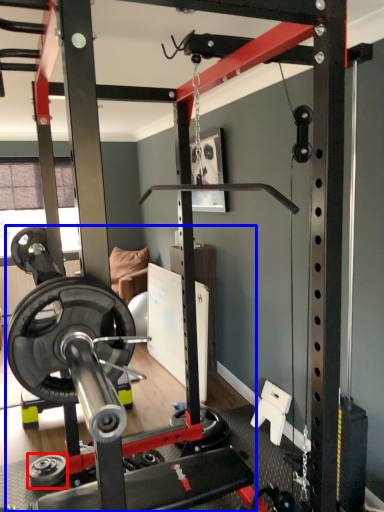
Question: Among these objects, which one is nearest to the camera, wheel (highlighted by a red box) or barbell (highlighted by a blue box)?

Choices:
 (A) wheel
 (B) barbell

Answer: (B)